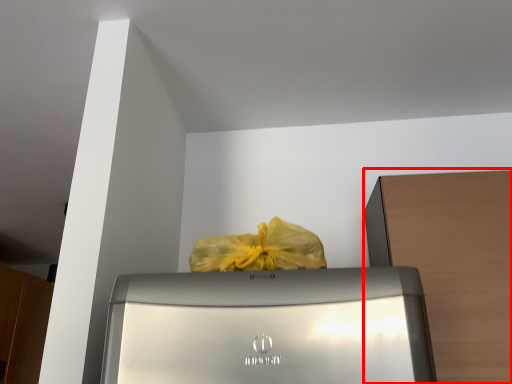
Question: Observing the image, what is the correct spatial positioning of cabinetry (annotated by the red box) in reference to cabinetry?

Choices:
 (A) right
 (B) left

Answer: (A)